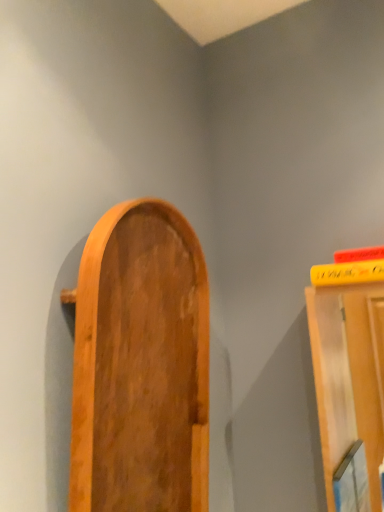
The image size is (384, 512). What do you see at coordinates (347, 273) in the screenshot? I see `yellow matte book at upper right` at bounding box center [347, 273].

You are a GUI agent. You are given a task and a screenshot of the screen. Output one action in this format:
    pyautogui.click(x=<x>, y=<y>)
    Task: Click on the yellow matte book at upper right
    The image size is (384, 512).
    Given the screenshot: What is the action you would take?
    point(347,273)

Where is `wooden door at center`? This screenshot has width=384, height=512. wooden door at center is located at coordinates (140, 365).

Image resolution: width=384 pixels, height=512 pixels. Describe the element at coordinates (140, 365) in the screenshot. I see `wooden door at center` at that location.

Identify the location of yellow matte book at upper right. (347, 273).

Is wooden door at center to the right of yellow matte book at upper right from the viewer's perspective?

In fact, wooden door at center is to the left of yellow matte book at upper right.

Which is behind, wooden door at center or yellow matte book at upper right?

yellow matte book at upper right is more distant.

Is point (107, 282) in front of point (381, 279)?

Yes, it is in front of point (381, 279).

From the image's perspective, is wooden door at center located above or below yellow matte book at upper right?

wooden door at center is below yellow matte book at upper right.

From a real-world perspective, does wooden door at center sit lower than yellow matte book at upper right?

Yes, from a real-world perspective, wooden door at center is beneath yellow matte book at upper right.

Considering the sizes of objects wooden door at center and yellow matte book at upper right in the image provided, who is thinner, wooden door at center or yellow matte book at upper right?

Thinner between the two is wooden door at center.

Which of these two, wooden door at center or yellow matte book at upper right, stands taller?

wooden door at center is taller.

Between wooden door at center and yellow matte book at upper right, which one has larger size?

wooden door at center.

Is wooden door at center positioned beyond the bounds of yellow matte book at upper right?

wooden door at center lies outside yellow matte book at upper right's area.

Does wooden door at center touch yellow matte book at upper right?

No, wooden door at center is not next to yellow matte book at upper right.

Is wooden door at center oriented away from yellow matte book at upper right?

That's not correct — wooden door at center is not looking away from yellow matte book at upper right.

Identify the location of book located above the wooden door at center (from the image's perspective). The width and height of the screenshot is (384, 512). (347, 273).

Can you confirm if yellow matte book at upper right is positioned to the right of wooden door at center?

Indeed, yellow matte book at upper right is positioned on the right side of wooden door at center.

Does yellow matte book at upper right lie in front of wooden door at center?

No, it is not.

Which is closer, [317,281] or [146,472]?

Point [317,281] is positioned farther from the camera compared to point [146,472].

In the scene shown: From the image's perspective, would you say yellow matte book at upper right is positioned over wooden door at center?

Yes, from the image's perspective, yellow matte book at upper right is on top of wooden door at center.

From a real-world perspective, is yellow matte book at upper right physically above wooden door at center?

Yes.

Can you confirm if yellow matte book at upper right is wider than wooden door at center?

Yes, yellow matte book at upper right is wider than wooden door at center.

Considering the sizes of objects yellow matte book at upper right and wooden door at center in the image provided, who is shorter, yellow matte book at upper right or wooden door at center?

yellow matte book at upper right is shorter.

Which of these two, yellow matte book at upper right or wooden door at center, is smaller?

Smaller between the two is yellow matte book at upper right.

Is yellow matte book at upper right inside or outside of wooden door at center?

yellow matte book at upper right is outside wooden door at center.

Would you say yellow matte book at upper right is a long distance from wooden door at center?

That's not correct — yellow matte book at upper right is a little close to wooden door at center.

Is yellow matte book at upper right facing away from wooden door at center?

yellow matte book at upper right does not have its back to wooden door at center.

What's the angular difference between yellow matte book at upper right and wooden door at center's facing directions?

There is a 91.2-degree angle between the facing directions of yellow matte book at upper right and wooden door at center.

Find the location of a particular element. The height and width of the screenshot is (512, 384). door on the left of yellow matte book at upper right is located at coordinates (140, 365).

Image resolution: width=384 pixels, height=512 pixels. I want to click on door below the yellow matte book at upper right (from a real-world perspective), so 140,365.

You are a GUI agent. You are given a task and a screenshot of the screen. Output one action in this format:
    pyautogui.click(x=<x>, y=<y>)
    Task: Click on the book above the wooden door at center (from the image's perspective)
    This screenshot has height=512, width=384.
    Given the screenshot: What is the action you would take?
    pyautogui.click(x=347, y=273)